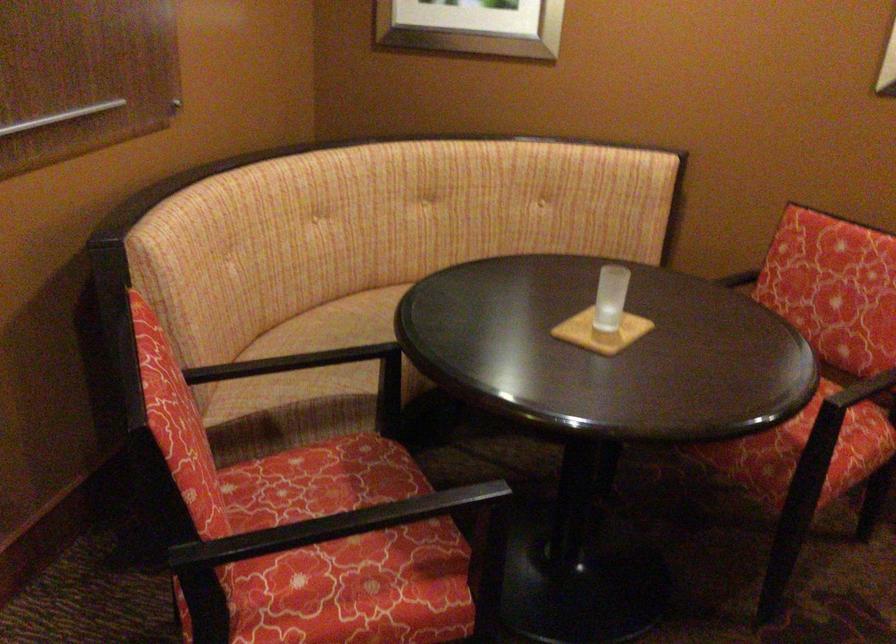
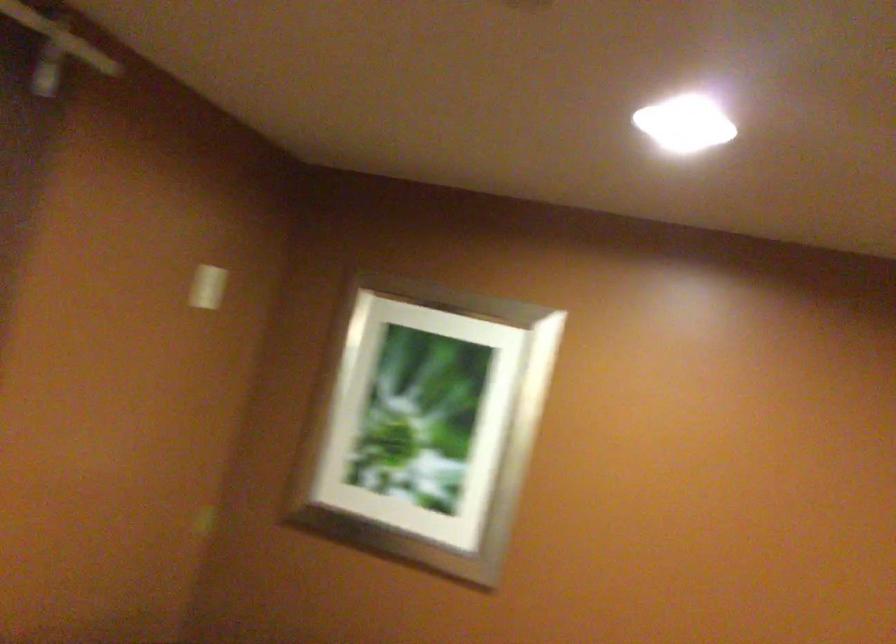
Question: The images are taken continuously from a first-person perspective. In which direction is your viewpoint rotating?

Choices:
 (A) Left
 (B) Right
 (C) Up
 (D) Down

Answer: (C)